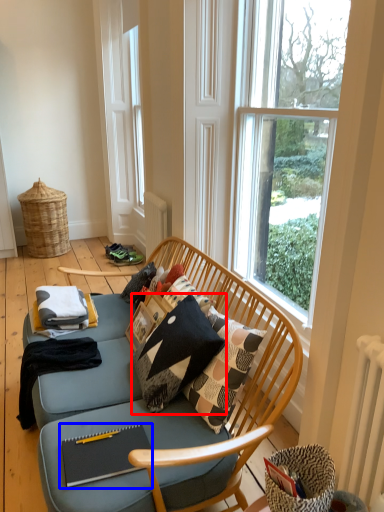
Question: Which object is closer to the camera taking this photo, throw pillow (highlighted by a red box) or magazine (highlighted by a blue box)?

Choices:
 (A) throw pillow
 (B) magazine

Answer: (B)